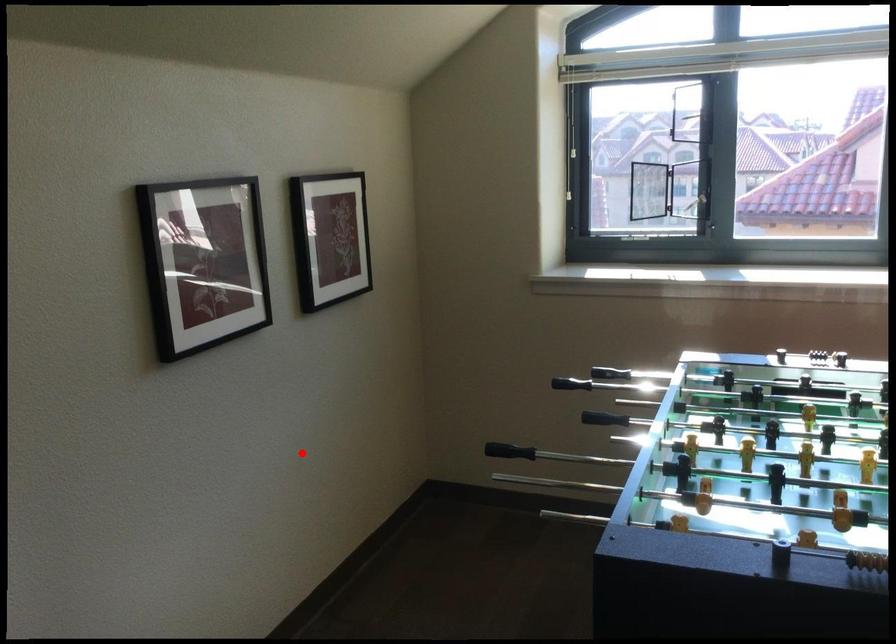
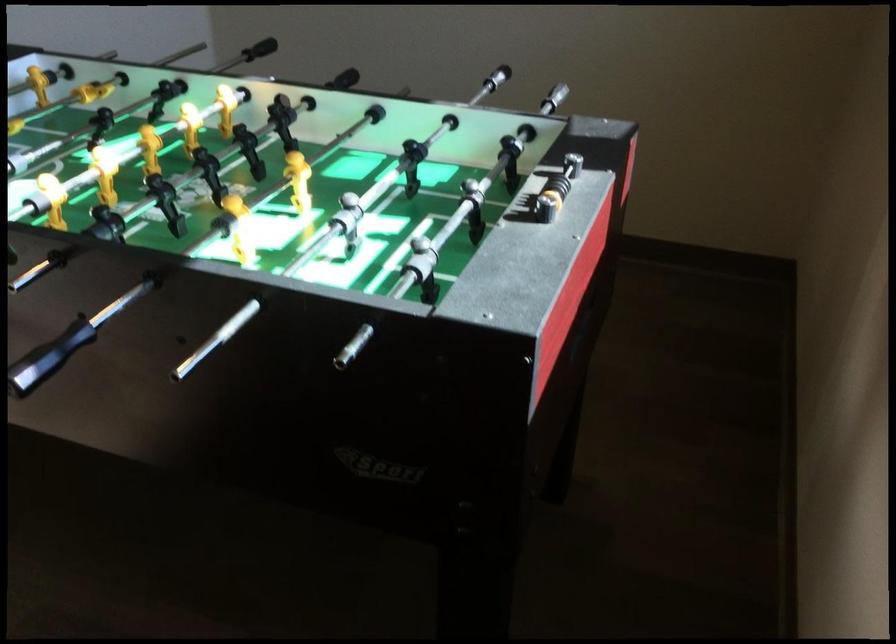
Where in the second image is the point corresponding to the highlighted location from the first image?

(496, 78)